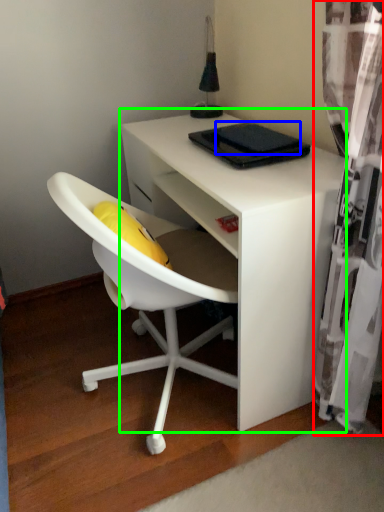
Question: Considering the real-world distances, which object is closest to curtain (highlighted by a red box)? pad (highlighted by a blue box) or desk (highlighted by a green box).

Choices:
 (A) pad
 (B) desk

Answer: (B)